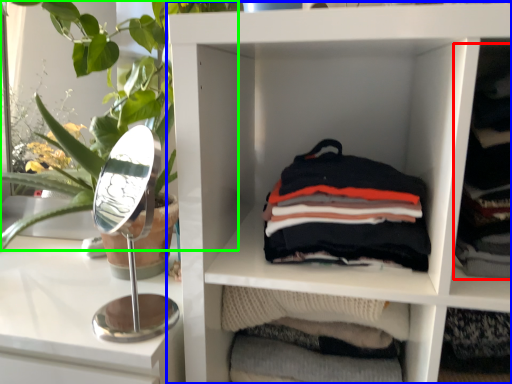
Question: Estimate the real-world distances between objects in this image. Which object is farther from clothing (highlighted by a red box), shelf (highlighted by a blue box) or plant (highlighted by a green box)?

Choices:
 (A) shelf
 (B) plant

Answer: (B)